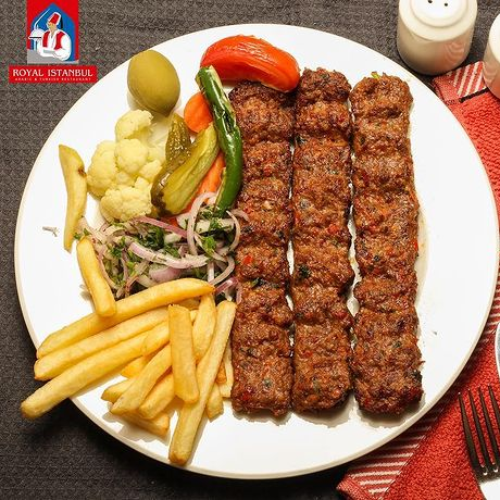
You are a GUI agent. You are given a task and a screenshot of the screen. Output one action in this format:
    pyautogui.click(x=<x>, y=<y>)
    Task: Click on the fabric
    
    Given the screenshot: What is the action you would take?
    pyautogui.click(x=30, y=131)